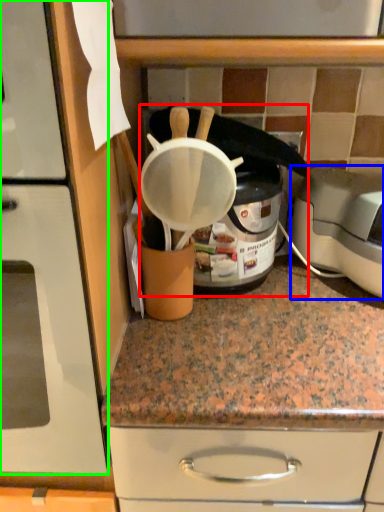
Question: Based on their relative distances, which object is nearer to appliance (highlighted by a red box)? Choose from toaster (highlighted by a blue box) and home appliance (highlighted by a green box).

Choices:
 (A) toaster
 (B) home appliance

Answer: (A)